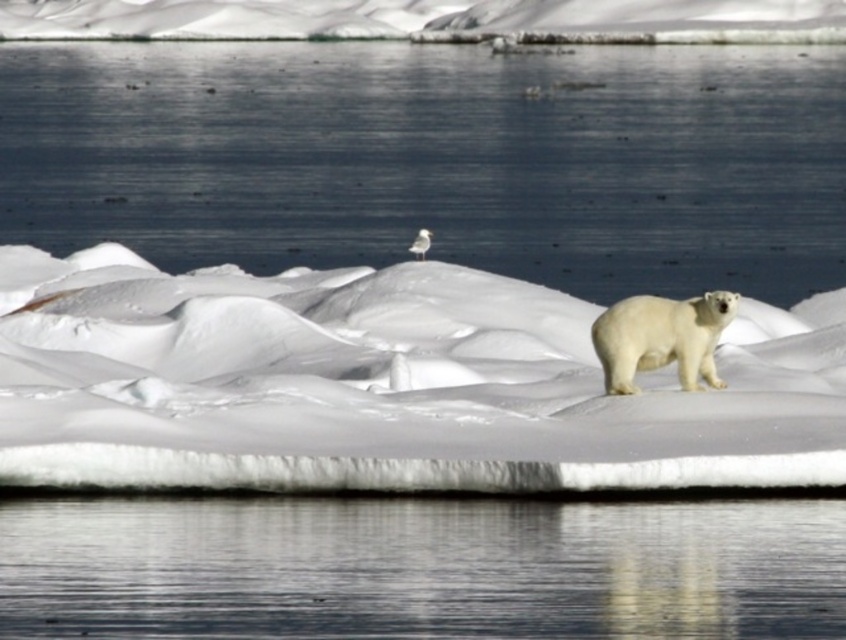
Question: Which object is closer to the camera taking this photo?

Choices:
 (A) white fur polar bear at right
 (B) white fluffy snow at center
 (C) transparent water at lower center

Answer: (C)

Question: Which point is farther from the camera taking this photo?

Choices:
 (A) click(105, 8)
 (B) click(42, 611)

Answer: (A)

Question: Can you confirm if transparent water at lower center is wider than white fluffy snow at upper center?

Choices:
 (A) yes
 (B) no

Answer: (B)

Question: Can you confirm if white fluffy snow at center is wider than transparent water at lower center?

Choices:
 (A) no
 (B) yes

Answer: (B)

Question: Does transparent water at lower center appear on the left side of white fluffy snow at upper center?

Choices:
 (A) yes
 (B) no

Answer: (B)

Question: Which object appears closest to the camera in this image?

Choices:
 (A) white fluffy snow at upper center
 (B) white fluffy snow at center

Answer: (B)